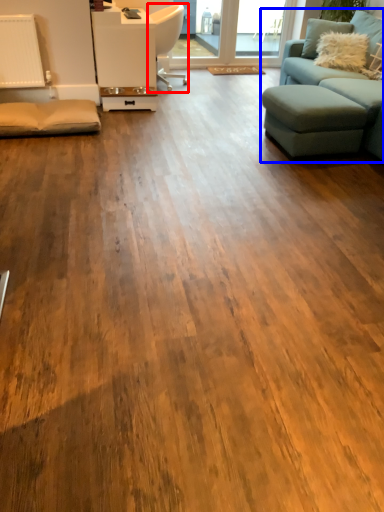
Question: Which of the following is the farthest to the observer, chair (highlighted by a red box) or studio couch (highlighted by a blue box)?

Choices:
 (A) chair
 (B) studio couch

Answer: (A)